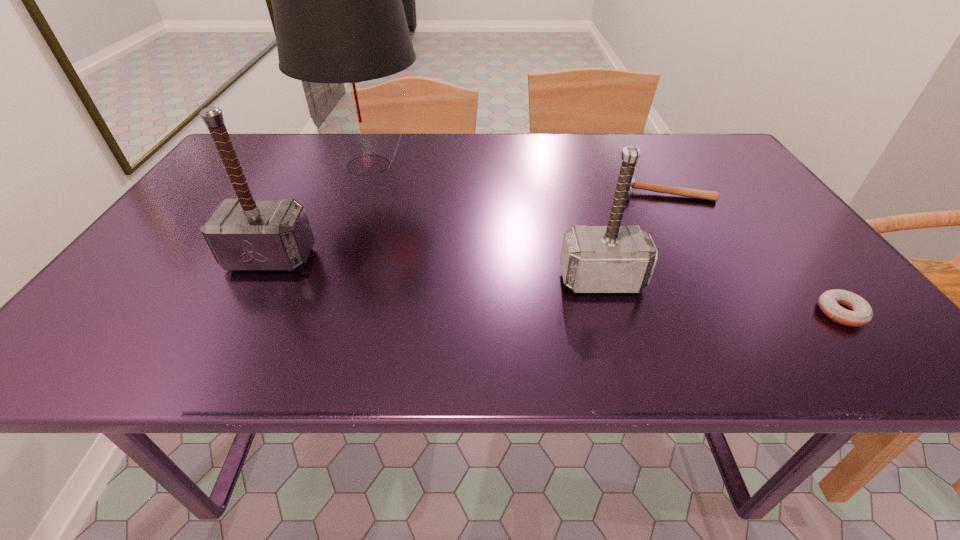
I want to click on the second closest object relative to the third object from right to left, so click(x=860, y=313).

Identify the location of hammer that is the third closest one to the lampshade. (693, 193).

Identify which hammer is the closest to the leftmost hammer. Please provide its 2D coordinates. Your answer should be formatted as a tuple, i.e. [(x, y)], where the tuple contains the x and y coordinates of a point satisfying the conditions above.

[(595, 259)]

This screenshot has height=540, width=960. Find the location of `vacant space that satisfies the following two spatial constraints: 1. for striking with the head of the rightmost object; 2. on the left side of the second hammer from right to left`. vacant space that satisfies the following two spatial constraints: 1. for striking with the head of the rightmost object; 2. on the left side of the second hammer from right to left is located at coordinates click(611, 313).